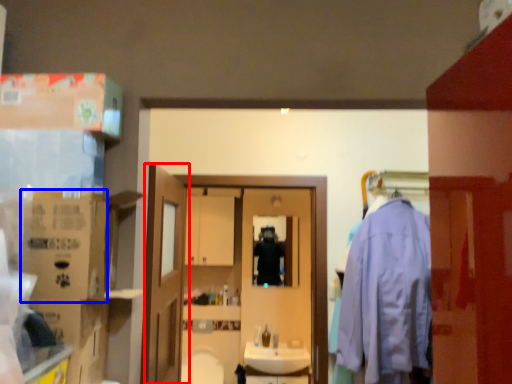
Question: Which object appears closest to the camera in this image, door (highlighted by a red box) or cardboard box (highlighted by a blue box)?

Choices:
 (A) door
 (B) cardboard box

Answer: (B)